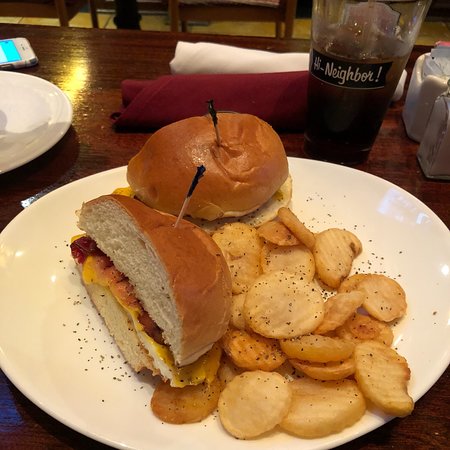
Locate an element on the screen. This screenshot has width=450, height=450. floor is located at coordinates (265, 31).